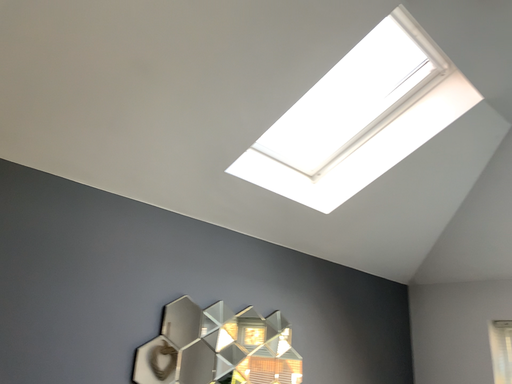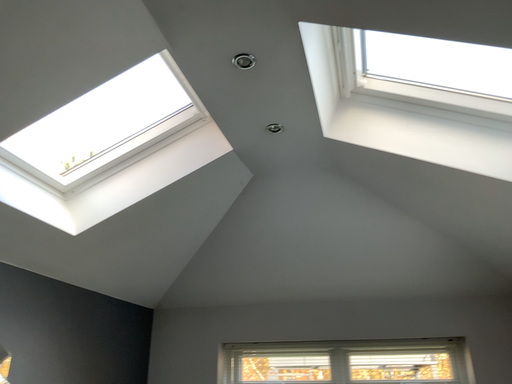
Question: How did the camera likely rotate when shooting the video?

Choices:
 (A) rotated left
 (B) rotated right

Answer: (B)